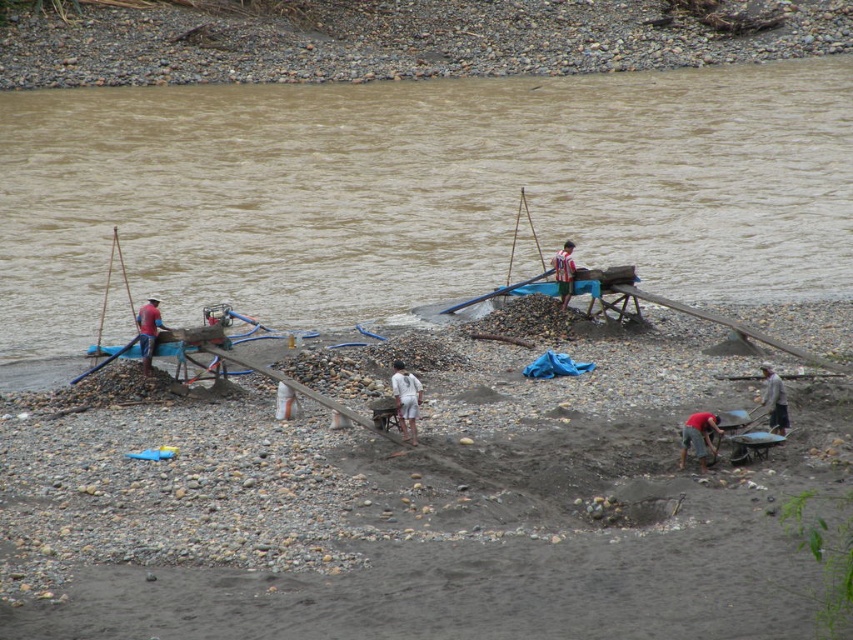
Question: In this image, where is gray fabric at lower right located relative to red shirt man at center?

Choices:
 (A) right
 (B) left

Answer: (A)

Question: Which point is closer to the camera?

Choices:
 (A) white cotton shirt at center
 (B) brown muddy water at center
 (C) gray fabric at lower right

Answer: (A)

Question: Can you confirm if brown muddy water at center is positioned below red shirt man at center?

Choices:
 (A) yes
 (B) no

Answer: (B)

Question: Which of these objects is positioned farthest from the red fabric shirt at lower right?

Choices:
 (A) red shirt man at center
 (B) gray fabric at lower right

Answer: (A)

Question: Is red fabric shirt at lower right bigger than striped shirt man at center?

Choices:
 (A) no
 (B) yes

Answer: (A)

Question: Estimate the real-world distances between objects in this image. Which object is farther from the brown muddy water at center?

Choices:
 (A) red fabric shirt at lower right
 (B) white cotton shirt at center
 (C) striped shirt man at center

Answer: (B)